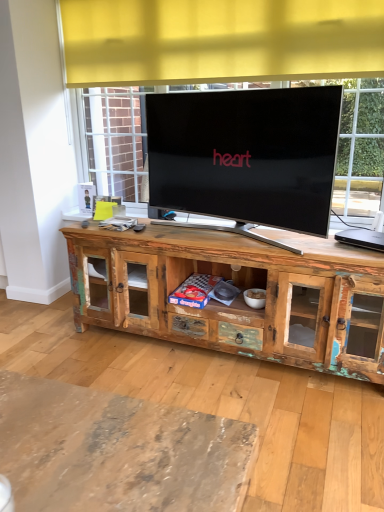
Question: From the image's perspective, relative to black plastic laptop at right, is rustic wood cabinet at center above or below?

Choices:
 (A) above
 (B) below

Answer: (B)

Question: In the image, is rustic wood cabinet at center positioned in front of or behind black plastic laptop at right?

Choices:
 (A) front
 (B) behind

Answer: (A)

Question: Is rustic wood cabinet at center to the left or to the right of black plastic laptop at right in the image?

Choices:
 (A) right
 (B) left

Answer: (B)

Question: In the image, is black plastic laptop at right on the left side or the right side of rustic wood cabinet at center?

Choices:
 (A) left
 (B) right

Answer: (B)

Question: From the image's perspective, is black plastic laptop at right positioned above or below rustic wood cabinet at center?

Choices:
 (A) below
 (B) above

Answer: (B)

Question: Based on their sizes in the image, would you say black plastic laptop at right is bigger or smaller than rustic wood cabinet at center?

Choices:
 (A) big
 (B) small

Answer: (B)

Question: Is black plastic laptop at right in front of or behind rustic wood cabinet at center in the image?

Choices:
 (A) front
 (B) behind

Answer: (B)